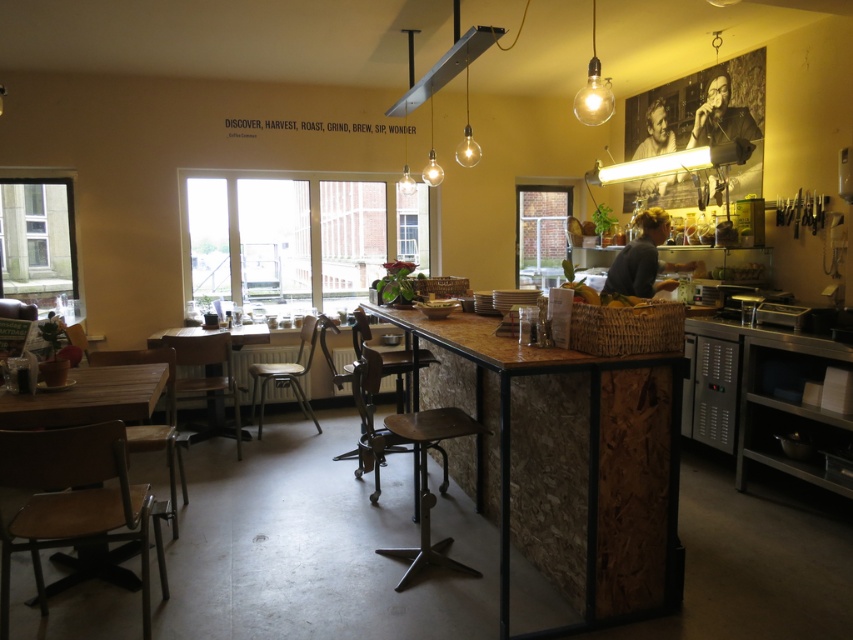
Looking at this image, between wooden textured table at center and wooden chair at lower left, which one appears on the left side from the viewer's perspective?

From the viewer's perspective, wooden chair at lower left appears more on the left side.

Who is more distant from viewer, (415, 394) or (73, 324)?

The point (73, 324) is more distant.

Is point (579, 499) positioned before point (73, 330)?

Yes, it is in front of point (73, 330).

Find the location of a particular element. This screenshot has height=640, width=853. wooden textured table at center is located at coordinates (569, 464).

Can you confirm if wooden seat at center is bigger than wooden chair at center?

No, wooden seat at center is not bigger than wooden chair at center.

Who is more distant from viewer, (426, 502) or (213, 394)?

Positioned behind is point (213, 394).

Who is more forward, (422, 464) or (223, 428)?

Point (422, 464) is more forward.

The image size is (853, 640). Identify the location of wooden seat at center. (426, 481).

Who is positioned more to the left, wooden seat at lower left or translucent glass bulb at upper center?

From the viewer's perspective, wooden seat at lower left appears more on the left side.

Does wooden seat at lower left have a greater height compared to translucent glass bulb at upper center?

Correct, wooden seat at lower left is much taller as translucent glass bulb at upper center.

Between point (144, 593) and point (601, 100), which one is positioned in front?

Point (144, 593) is in front.

In order to click on wooden seat at lower left in this screenshot , I will do `click(70, 499)`.